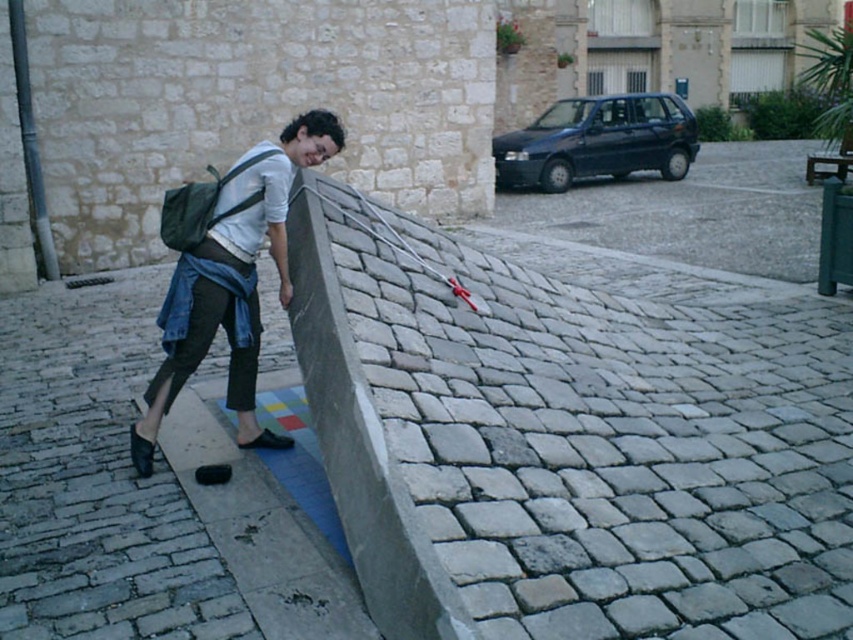
You are navigating an outdoor urban area and need to place a new bench. The bench requires a flat surface that is at least 1.5 meters wide. Is the gray concrete ledge at center suitable for this purpose?

The gray concrete ledge at center is located at point (567, 444), but without specific width information provided in the Objects Description, it cannot be determined if it meets the bench requirement.

You are a delivery person standing at the edge of the cobblestone street. You need to move the gray concrete ledge at center to the other side of the street. The street is 3 meters wide. Can you reach the ledge from your current position without stepping onto the street?

The gray concrete ledge at center is 2.80 meters away from the viewer. Since the street is 3 meters wide, the distance between you and the ledge is less than the street width, so you can reach it without stepping onto the street.

You are trying to place the denim jacket at left on top of the gray concrete ledge at center. Can you do this without any additional support?

The gray concrete ledge at center has a greater height compared to denim jacket at left, so the denim jacket at left can be placed on top of the gray concrete ledge at center since the ledge is taller and provides a stable base.